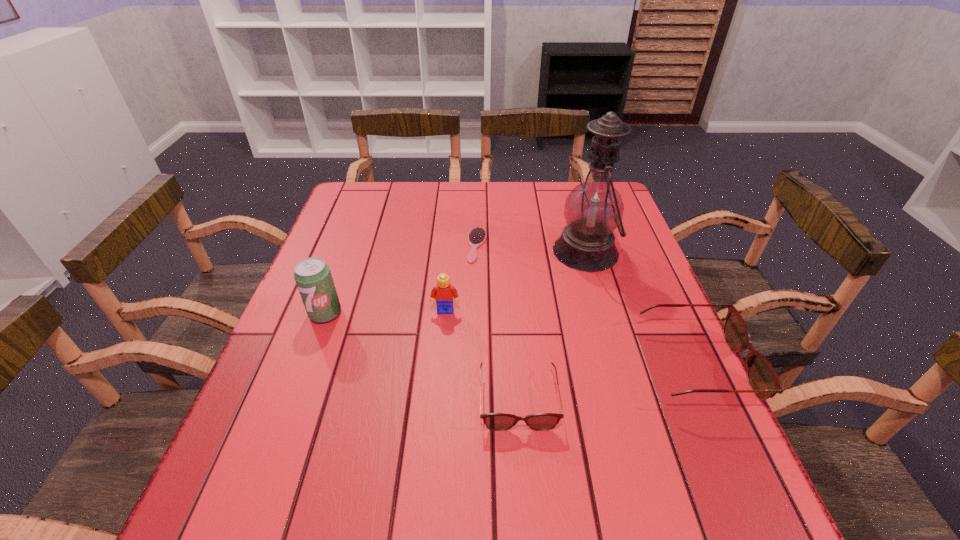
Where is `vacant space that's between the third shortest object and the oil lamp`? vacant space that's between the third shortest object and the oil lamp is located at coordinates (640, 309).

Locate an element on the screen. vacant space that is in between the tallest object and the left spectacles is located at coordinates (552, 326).

Where is `unoccupied area between the fourth tallest object and the fifth tallest object`? The height and width of the screenshot is (540, 960). unoccupied area between the fourth tallest object and the fifth tallest object is located at coordinates (607, 383).

Image resolution: width=960 pixels, height=540 pixels. In order to click on the second closest object relative to the fourth shortest object in this screenshot , I will do `click(494, 421)`.

This screenshot has height=540, width=960. What are the coordinates of `the fourth closest object to the right spectacles` in the screenshot? It's located at (477, 236).

Where is `vacant space that satisfies the following two spatial constraints: 1. at the front view of the right spectacles; 2. at the front view of the second shortest object`? The width and height of the screenshot is (960, 540). vacant space that satisfies the following two spatial constraints: 1. at the front view of the right spectacles; 2. at the front view of the second shortest object is located at coordinates (709, 400).